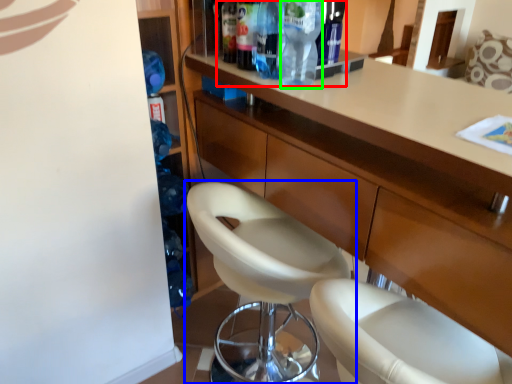
Question: Which is nearer to the bottle (highlighted by a red box)? chair (highlighted by a blue box) or bottle (highlighted by a green box).

Choices:
 (A) chair
 (B) bottle

Answer: (B)